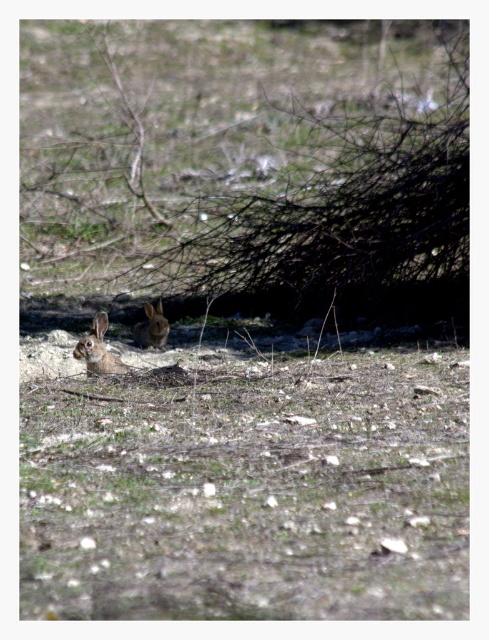
Question: Can you confirm if furry brown rabbit at lower left is smaller than brown furry rabbit at center?

Choices:
 (A) no
 (B) yes

Answer: (B)

Question: Which object is farther from the camera taking this photo?

Choices:
 (A) brown textured tree at center
 (B) furry brown rabbit at lower left
 (C) brown furry rabbit at center

Answer: (C)

Question: Which object is closer to the camera taking this photo?

Choices:
 (A) brown textured tree at center
 (B) furry brown rabbit at lower left
 (C) brown furry rabbit at center

Answer: (B)

Question: From the image, what is the correct spatial relationship of brown textured tree at center in relation to furry brown rabbit at lower left?

Choices:
 (A) below
 (B) above

Answer: (B)

Question: Is brown textured tree at center smaller than brown furry rabbit at center?

Choices:
 (A) yes
 (B) no

Answer: (B)

Question: Which object appears farthest from the camera in this image?

Choices:
 (A) furry brown rabbit at lower left
 (B) brown grass at lower center

Answer: (A)